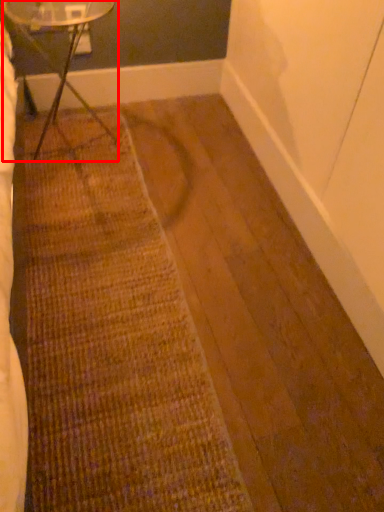
Question: In this image, where is table (annotated by the red box) located relative to doormat?

Choices:
 (A) left
 (B) right

Answer: (A)